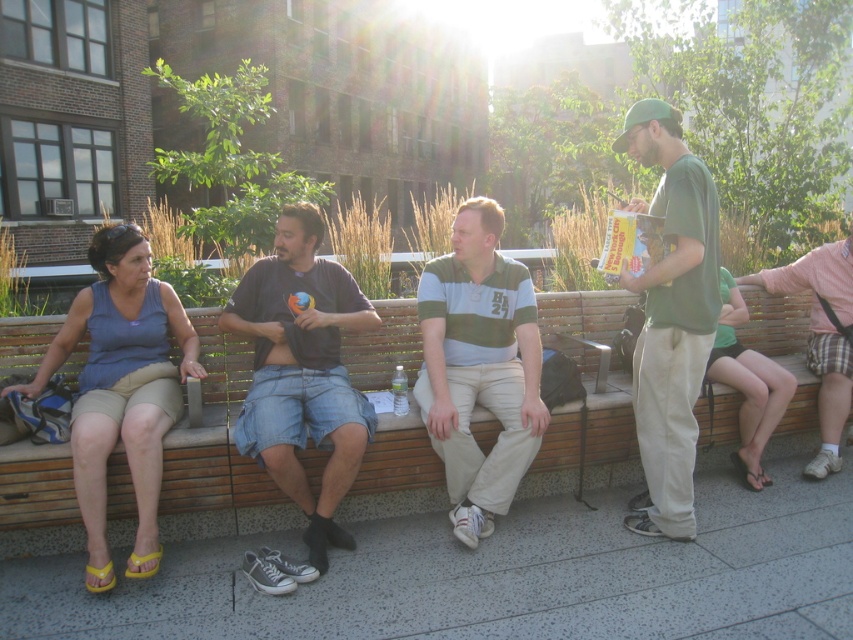
Which is above, denim shorts at center or green cotton shirt at right?

green cotton shirt at right is above.

Does denim shorts at center have a greater height compared to green cotton shirt at right?

No.

Describe the element at coordinates (302, 371) in the screenshot. This screenshot has width=853, height=640. I see `denim shorts at center` at that location.

The width and height of the screenshot is (853, 640). I want to click on denim shorts at center, so click(302, 371).

How much distance is there between striped cotton polo shirt at center and green cotton shirt at right?

striped cotton polo shirt at center is 27.49 inches away from green cotton shirt at right.

Does striped cotton polo shirt at center lie in front of green cotton shirt at right?

No.

What do you see at coordinates (479, 365) in the screenshot?
I see `striped cotton polo shirt at center` at bounding box center [479, 365].

You are a GUI agent. You are given a task and a screenshot of the screen. Output one action in this format:
    pyautogui.click(x=<x>, y=<y>)
    Task: Click on the striped cotton polo shirt at center
    
    Given the screenshot: What is the action you would take?
    pyautogui.click(x=479, y=365)

Who is positioned more to the right, denim shorts at center or green fabric shorts at right?

green fabric shorts at right

Can you confirm if denim shorts at center is smaller than green fabric shorts at right?

Incorrect, denim shorts at center is not smaller in size than green fabric shorts at right.

Is point (288, 424) behind point (729, 298)?

No, it is not.

You are a GUI agent. You are given a task and a screenshot of the screen. Output one action in this format:
    pyautogui.click(x=<x>, y=<y>)
    Task: Click on the denim shorts at center
    This screenshot has width=853, height=640.
    Given the screenshot: What is the action you would take?
    pyautogui.click(x=302, y=371)